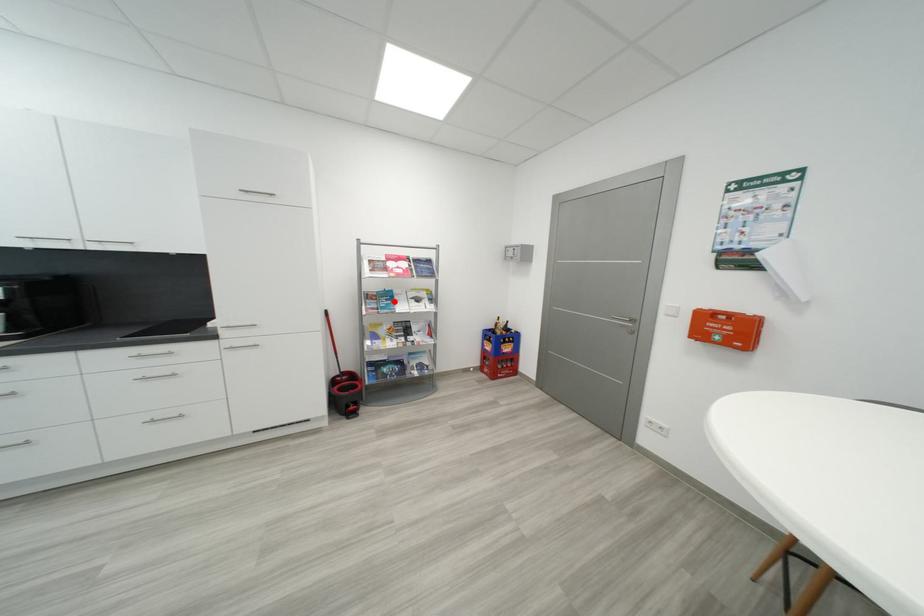
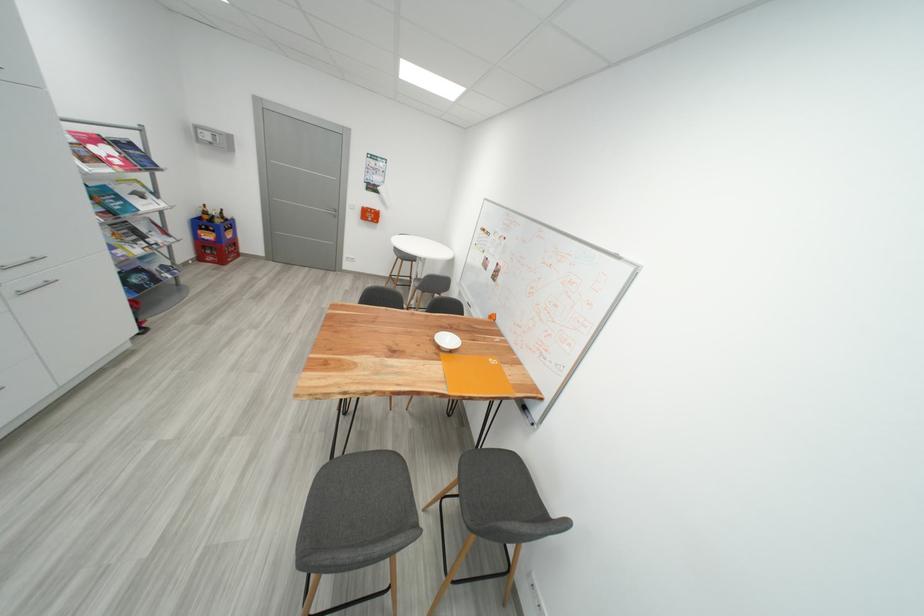
Where in the second image is the point corresponding to the highlighted location from the first image?

(122, 201)